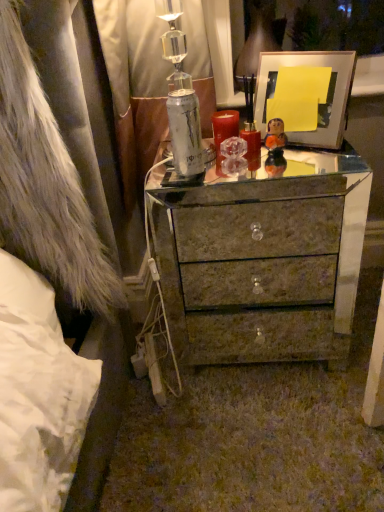
Question: From the image's perspective, is matte white picture frame at upper right over shiny metallic chest of drawers at center?

Choices:
 (A) no
 (B) yes

Answer: (B)

Question: Is matte white picture frame at upper right at the right side of shiny metallic chest of drawers at center?

Choices:
 (A) yes
 (B) no

Answer: (A)

Question: Can you see matte white picture frame at upper right touching shiny metallic chest of drawers at center?

Choices:
 (A) yes
 (B) no

Answer: (B)

Question: Is the depth of matte white picture frame at upper right greater than that of shiny metallic chest of drawers at center?

Choices:
 (A) yes
 (B) no

Answer: (A)

Question: Is matte white picture frame at upper right to the left of shiny metallic chest of drawers at center from the viewer's perspective?

Choices:
 (A) no
 (B) yes

Answer: (A)

Question: Is matte white picture frame at upper right turned away from shiny metallic chest of drawers at center?

Choices:
 (A) yes
 (B) no

Answer: (B)

Question: Considering the relative sizes of marble-like drawer at center and fuzzy white fur coat at left in the image provided, is marble-like drawer at center thinner than fuzzy white fur coat at left?

Choices:
 (A) no
 (B) yes

Answer: (B)

Question: Can you confirm if marble-like drawer at center is taller than fuzzy white fur coat at left?

Choices:
 (A) yes
 (B) no

Answer: (B)

Question: Is there a large distance between marble-like drawer at center and fuzzy white fur coat at left?

Choices:
 (A) yes
 (B) no

Answer: (B)

Question: Does marble-like drawer at center come in front of fuzzy white fur coat at left?

Choices:
 (A) no
 (B) yes

Answer: (A)

Question: Can you confirm if marble-like drawer at center is positioned to the left of fuzzy white fur coat at left?

Choices:
 (A) yes
 (B) no

Answer: (B)

Question: Is fuzzy white fur coat at left completely or partially inside marble-like drawer at center?

Choices:
 (A) yes
 (B) no

Answer: (B)

Question: Is matte white picture frame at upper right thinner than marble-like drawer at center?

Choices:
 (A) no
 (B) yes

Answer: (A)